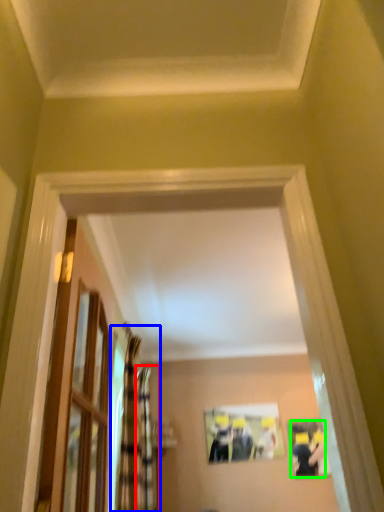
Question: Based on their relative distances, which object is farther from curtain (highlighted by a red box)? Choose from curtain (highlighted by a blue box) and couple (highlighted by a green box).

Choices:
 (A) curtain
 (B) couple

Answer: (B)